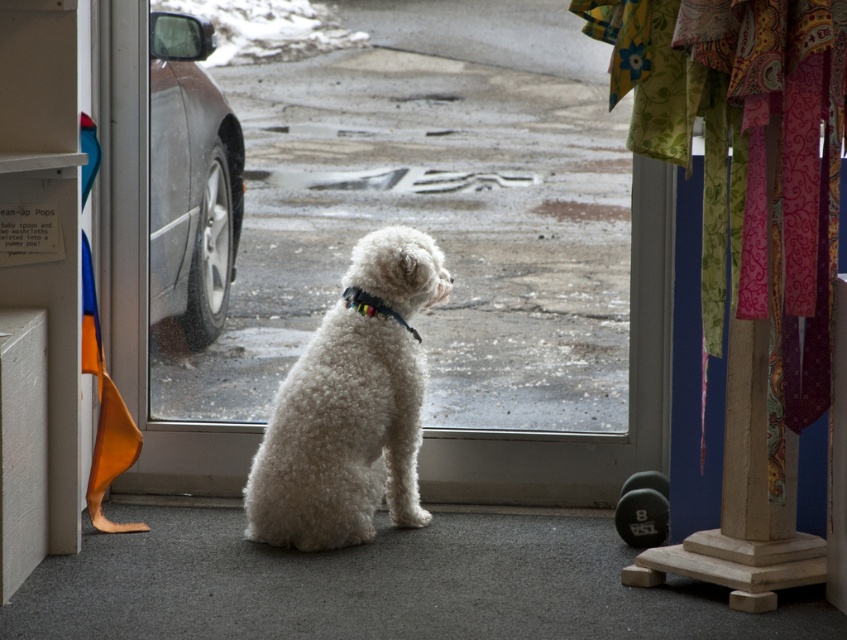
You are standing inside the home looking out through the glass door. There are two points marked in the image, point (x=454, y=442) and point (x=223, y=241). Which point is closer to you, the observer?

Point (x=454, y=442) is in front of point (x=223, y=241), so it is closer to you.

You are standing in the home looking through the glass door at the snowy street. There are two points marked in the image, point 1 at coordinates point [391,426] and point 2 at coordinates point [208,321]. Which point is closer to you?

Point [391,426] is closer to the viewer than point [208,321].